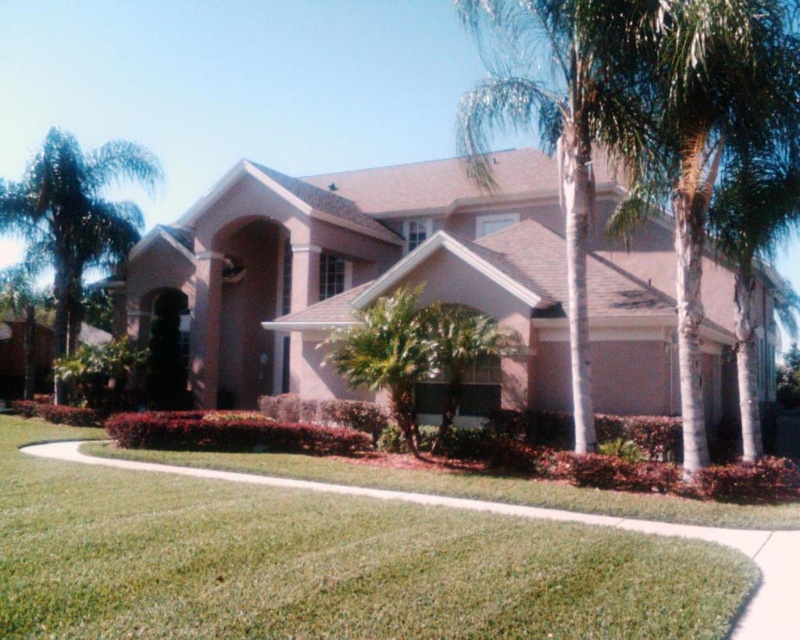
The width and height of the screenshot is (800, 640). Find the location of `green grass at center`. green grass at center is located at coordinates (325, 564).

Can you confirm if green grass at center is bigger than green leafy palm tree at left?

No, green grass at center is not bigger than green leafy palm tree at left.

Where is `green grass at center`? The height and width of the screenshot is (640, 800). green grass at center is located at coordinates (325, 564).

Does point (61, 150) lie in front of point (396, 336)?

That is False.

At what (x,y) coordinates should I click in order to perform the action: click on green leafy palm tree at left. Please return your answer as a coordinate pair (x, y). The image size is (800, 640). Looking at the image, I should click on (74, 216).

At what (x,y) coordinates should I click in order to perform the action: click on green leafy palm tree at left. Please return your answer as a coordinate pair (x, y). This screenshot has height=640, width=800. Looking at the image, I should click on 74,216.

Between point (396, 628) and point (406, 392), which one is positioned behind?

The point (406, 392) is more distant.

Is green grass at center below green leafy palm tree at center?

Indeed, green grass at center is positioned under green leafy palm tree at center.

Is point (40, 488) positioned before point (400, 353)?

Yes, point (40, 488) is closer to viewer.

What are the coordinates of `green grass at center` in the screenshot? It's located at (325, 564).